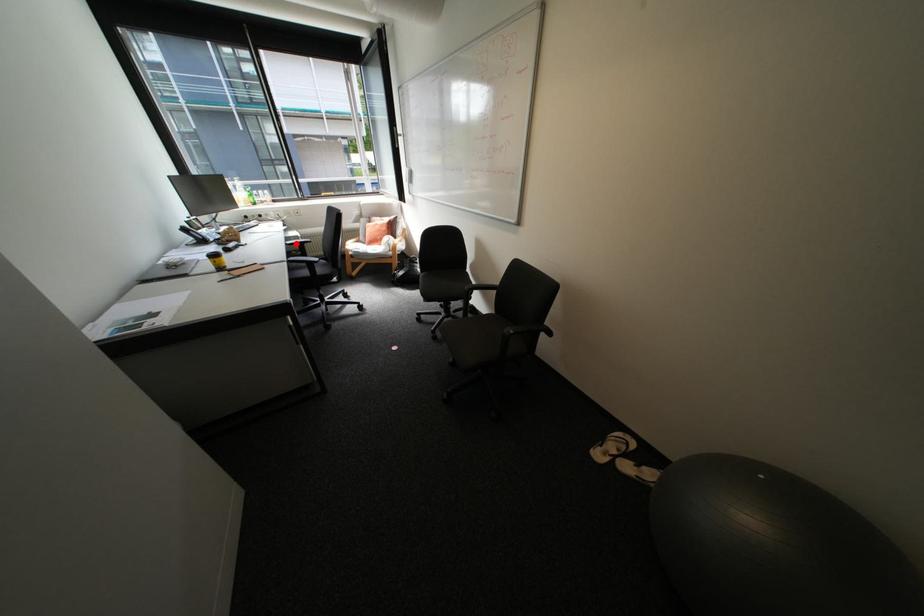
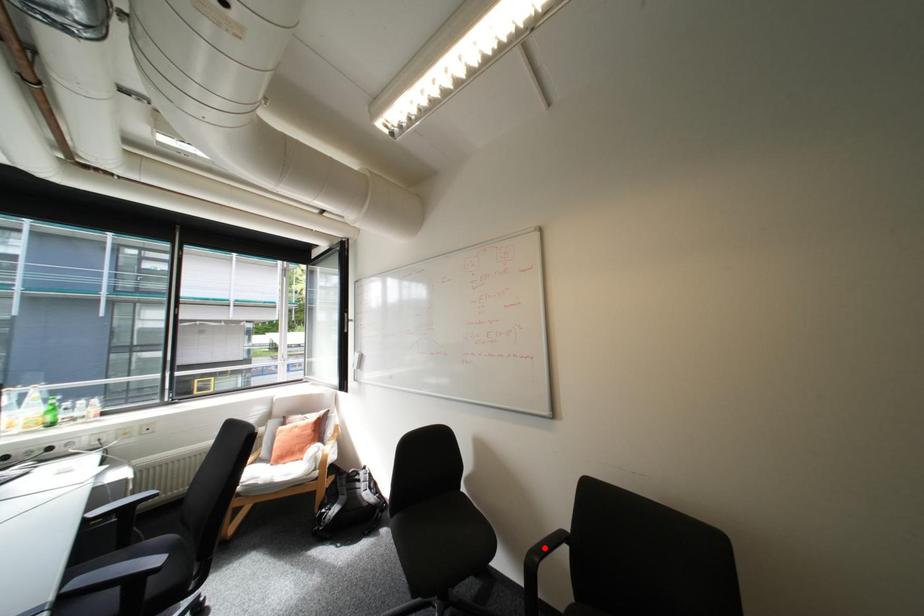
I am providing you with two images of the same scene from different viewpoints. A red point is marked on the first image and another point is marked on the second image. Is the marked point in image1 the same physical position as the marked point in image2?

No